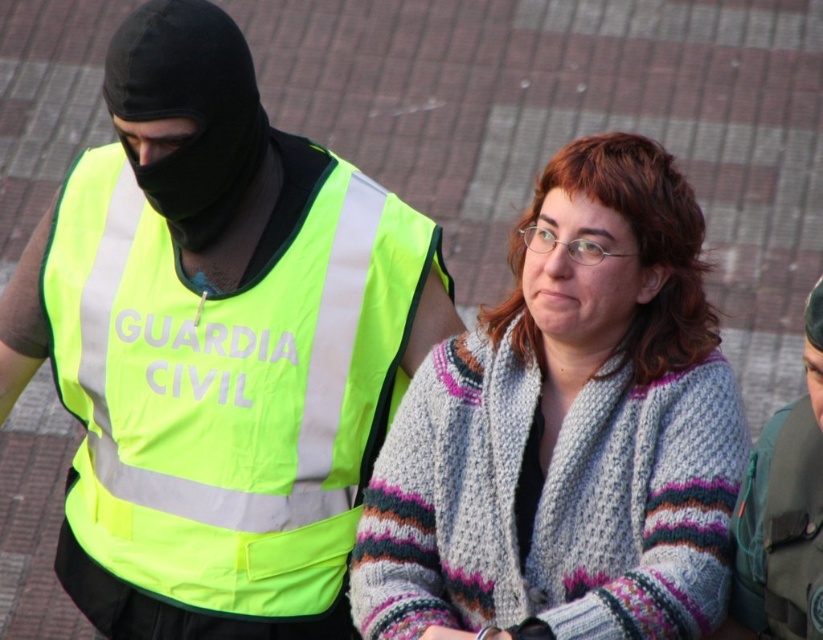
Question: Does neon yellow reflective vest at center appear over knitted sweater at center?

Choices:
 (A) yes
 (B) no

Answer: (A)

Question: Observing the image, what is the correct spatial positioning of neon yellow reflective vest at center in reference to knitted sweater at center?

Choices:
 (A) right
 (B) left

Answer: (B)

Question: Which object is farther from the camera taking this photo?

Choices:
 (A) neon yellow reflective vest at center
 (B) knitted sweater at center

Answer: (A)

Question: Can you confirm if neon yellow reflective vest at center is positioned to the right of knitted sweater at center?

Choices:
 (A) no
 (B) yes

Answer: (A)

Question: Which of the following is the closest to the observer?

Choices:
 (A) (233, 540)
 (B) (611, 266)

Answer: (B)